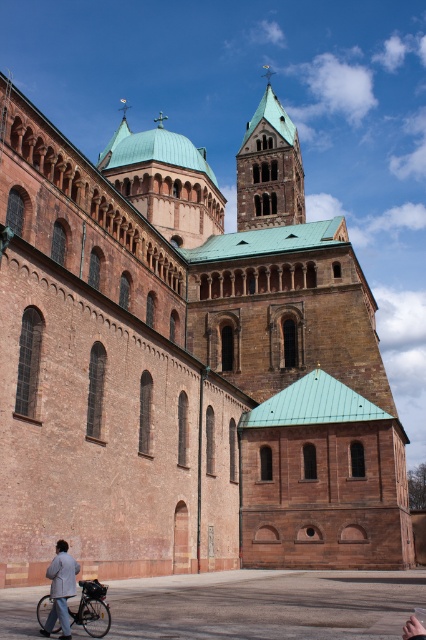
You are an architect visiting this historical building and notice the brown stone tower at upper center and the light gray fabric jacket at lower left. Which object is bigger in size?

The brown stone tower at upper center is larger in size than the light gray fabric jacket at lower left.

You are standing at the entrance of the grand historical building and want to park your silver metallic bicycle at lower left. The parking area is located at coordinates point 0.952, 0.216. Can you confirm if the bicycle is parked correctly?

The silver metallic bicycle at lower left is already positioned at the coordinates point (92, 609), so it is parked correctly at the designated parking area.